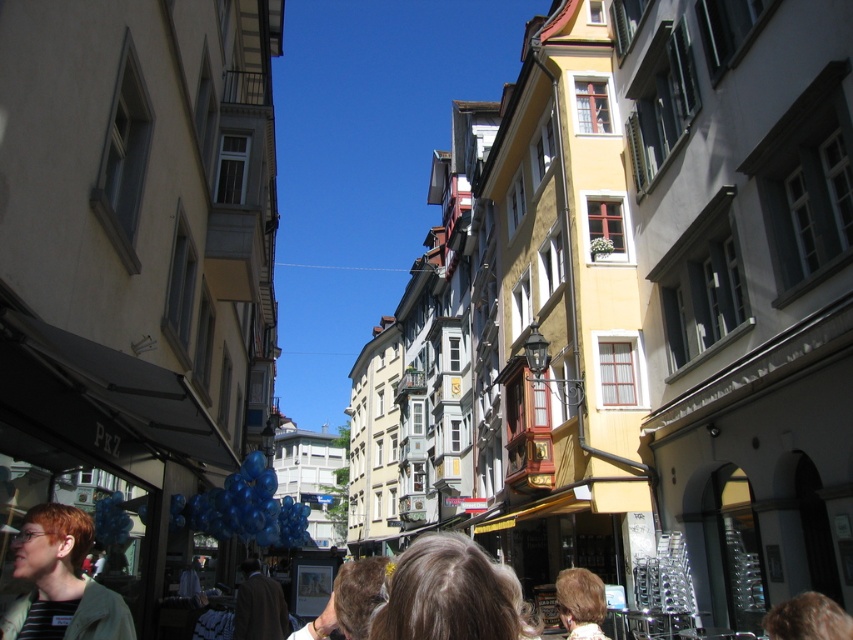
Who is taller, light brown hair at center or light brown hair at lower center?

Standing taller between the two is light brown hair at center.

Does point (404, 557) come in front of point (561, 624)?

Yes, it is.

Is point (463, 566) farther from viewer compared to point (579, 625)?

No, it is in front of (579, 625).

I want to click on light brown hair at center, so click(444, 593).